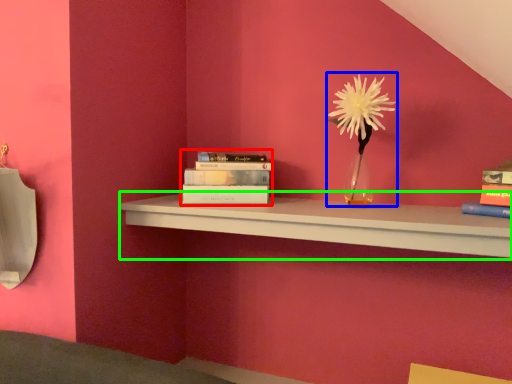
Question: Considering the real-world distances, which object is closest to book (highlighted by a red box)? floral arrangement (highlighted by a blue box) or shelf (highlighted by a green box).

Choices:
 (A) floral arrangement
 (B) shelf

Answer: (B)